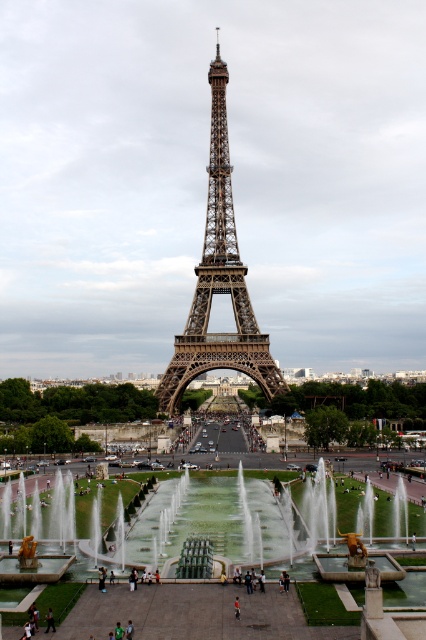
Can you confirm if brown metal eiffel tower at center is positioned to the right of dark blue jeans at center?

Correct, you'll find brown metal eiffel tower at center to the right of dark blue jeans at center.

Where is `brown metal eiffel tower at center`? The height and width of the screenshot is (640, 426). brown metal eiffel tower at center is located at coordinates (218, 282).